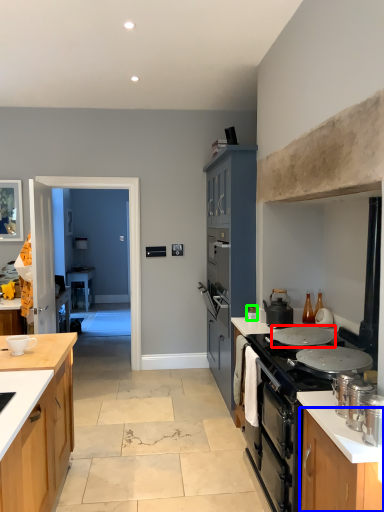
Question: Which is farther away from pot/pan (highlighted by a red box)? cabinetry (highlighted by a blue box) or kitchen appliance (highlighted by a green box)?

Choices:
 (A) cabinetry
 (B) kitchen appliance

Answer: (A)